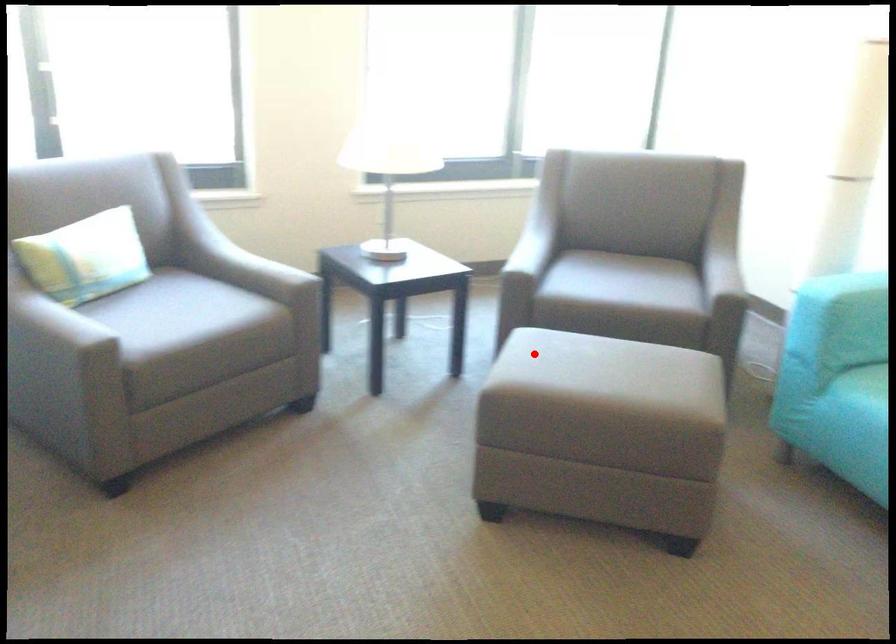
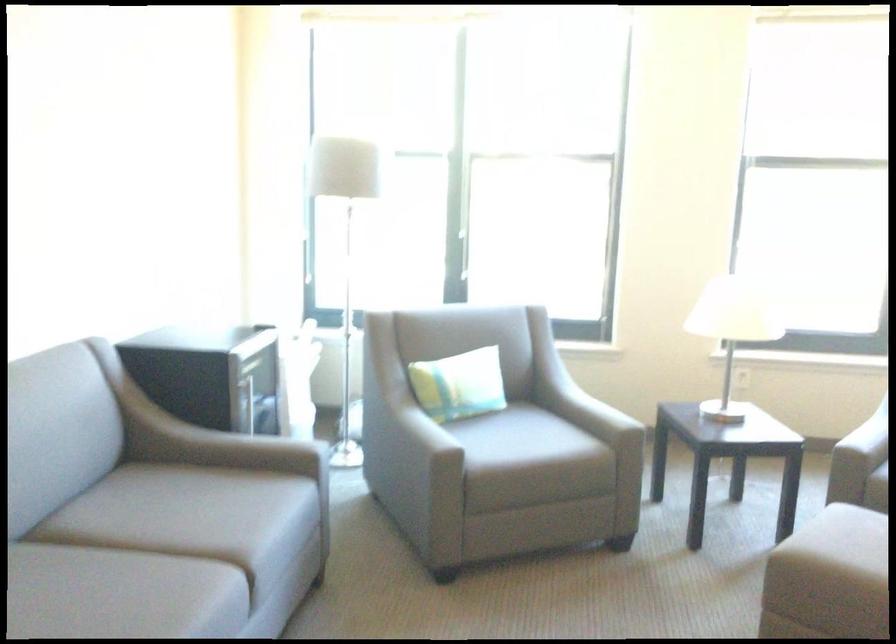
In the second image, find the point that corresponds to the highlighted location in the first image.

(849, 536)